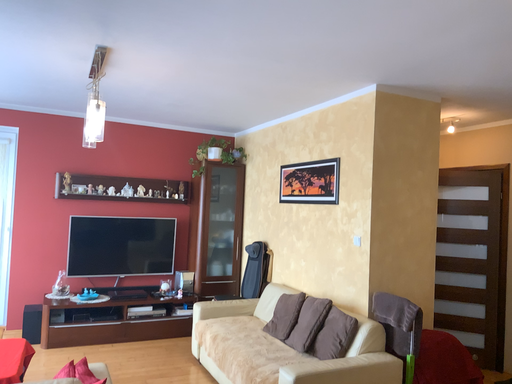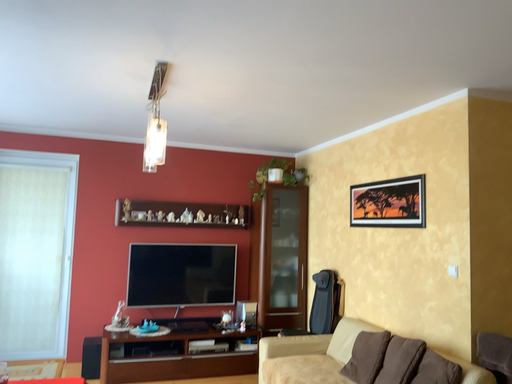
Question: How did the camera likely rotate when shooting the video?

Choices:
 (A) rotated left
 (B) rotated right

Answer: (A)